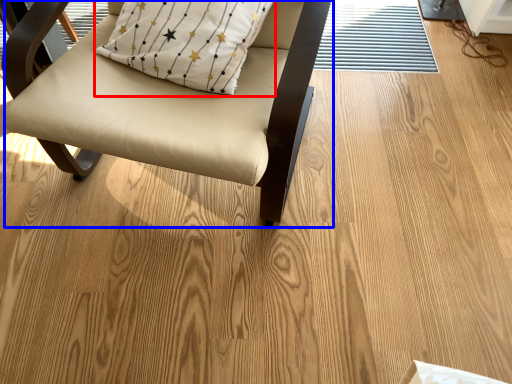
Question: Which of the following is the farthest to the observer, pillow (highlighted by a red box) or chair (highlighted by a blue box)?

Choices:
 (A) pillow
 (B) chair

Answer: (A)